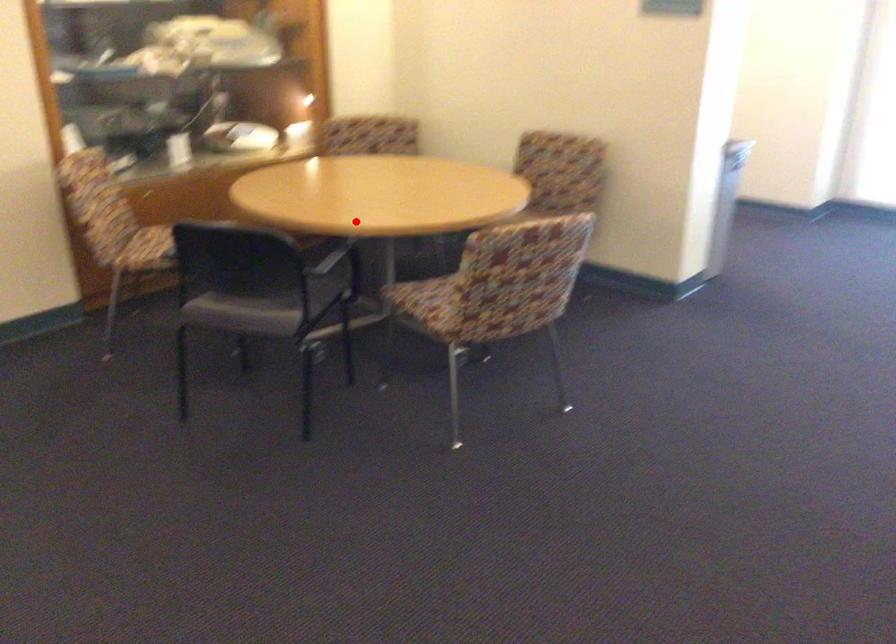
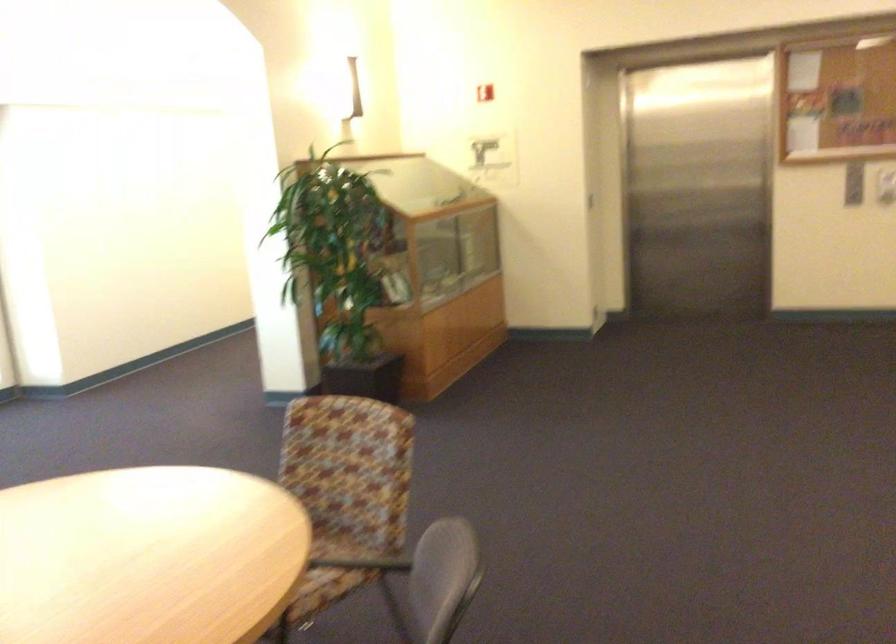
Locate, in the second image, the point that corresponds to the highlighted location in the first image.

(288, 535)